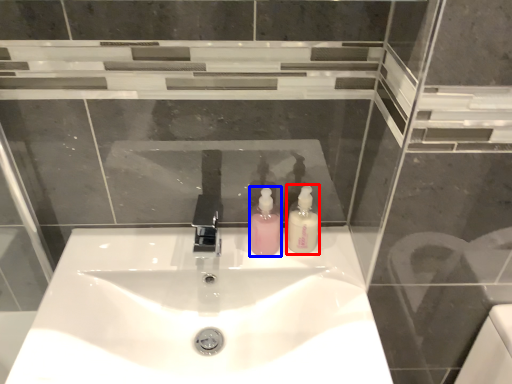
Question: Which object is further to the camera taking this photo, soap dispenser (highlighted by a red box) or soap dispenser (highlighted by a blue box)?

Choices:
 (A) soap dispenser
 (B) soap dispenser

Answer: (B)